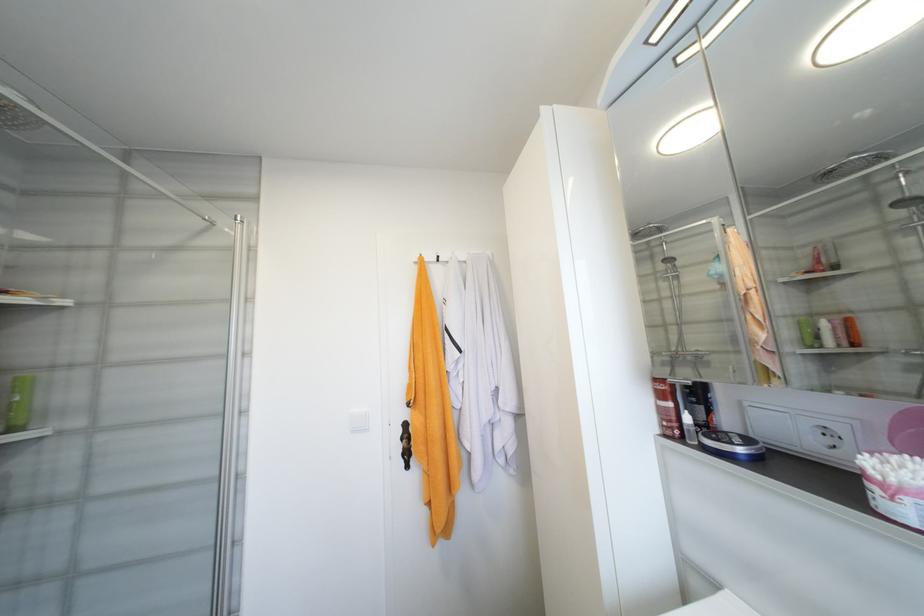
Identify the location of black door handle. (406, 444).